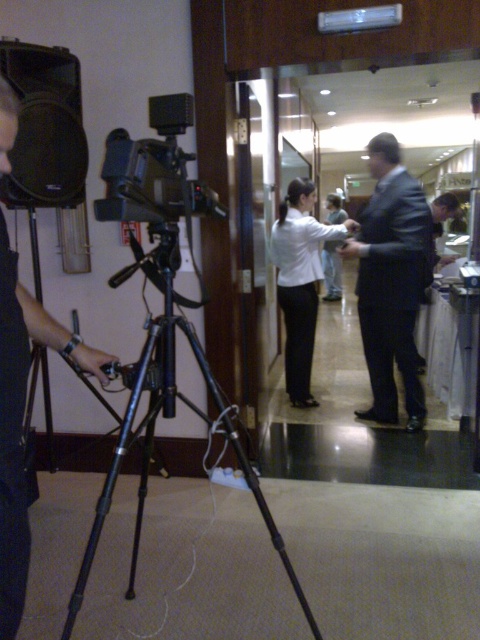
You are standing in the scene and want to move to the point at coordinates point (349, 227). Can you reach it without moving past the video camera mounted on a tripod?

The point (349, 227) is 3.73 meters away from the viewer. Since the video camera mounted on a tripod is in the foreground, you would need to move around it to reach the point, but the distance allows it. However, the question specifies not moving past the camera. Therefore, you cannot reach the point without moving past the video camera mounted on a tripod because the path to the point likely requires passing the camera which is in the foreground between you and the point.

You are a camera operator trying to adjust the camera angle to focus on the dark suit at center without moving the black metal tripod at lower left. Can you do this adjustment while keeping the tripod in its current position?

The dark suit at center is positioned over the black metal tripod at lower left, so adjusting the camera angle to focus on the dark suit at center can be done without moving the tripod since the tripod is already under the subject.

You are a camera operator adjusting the focus on the professional video camera mounted on a tripod. You need to ensure both the dark suit at center and the white shirt at center are in focus. Which subject should you focus on first to accommodate their size difference?

The dark suit at center is taller than the white shirt at center, so you should focus on the dark suit at center first to ensure proper depth of field for both subjects.